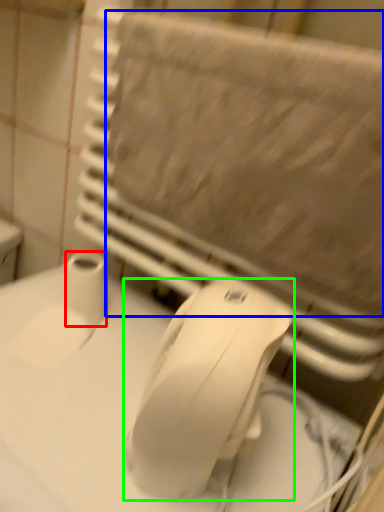
Question: Which object is the closest to the toilet paper (highlighted by a red box)? Choose among these: bath towel (highlighted by a blue box) or mouse (highlighted by a green box).

Choices:
 (A) bath towel
 (B) mouse

Answer: (A)